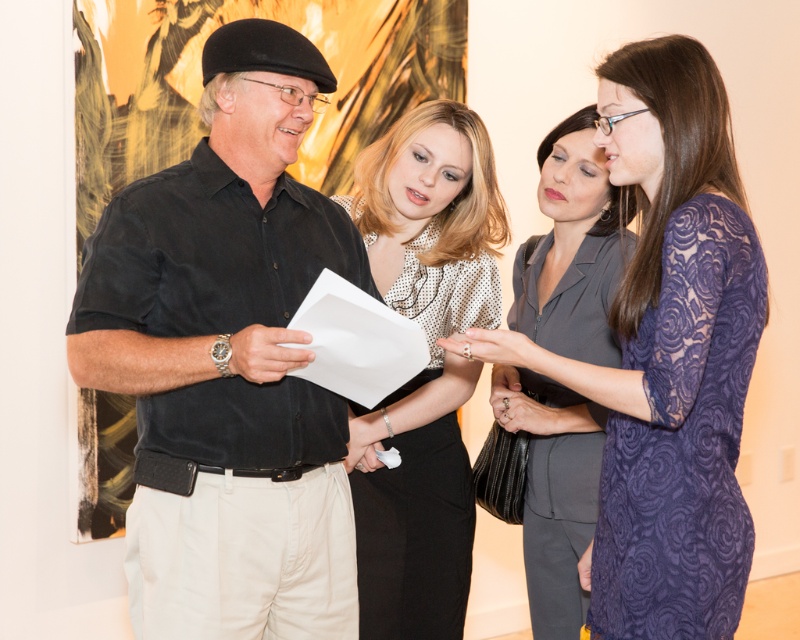
Question: Does polka dot blouse at center appear on the left side of matte gray suit at center?

Choices:
 (A) no
 (B) yes

Answer: (B)

Question: Which point is farther to the camera?

Choices:
 (A) (444, 461)
 (B) (594, 618)
 (C) (572, 572)
 (D) (162, 364)

Answer: (C)

Question: Is lace fabric dress at center to the right of matte gray suit at center from the viewer's perspective?

Choices:
 (A) no
 (B) yes

Answer: (B)

Question: Among these points, which one is nearest to the camera?

Choices:
 (A) (220, 220)
 (B) (408, 458)
 (C) (656, 312)

Answer: (C)

Question: Based on their relative distances, which object is farther from the polka dot blouse at center?

Choices:
 (A) lace fabric dress at center
 (B) matte gray suit at center

Answer: (A)

Question: Does lace fabric dress at center appear on the left side of matte gray suit at center?

Choices:
 (A) yes
 (B) no

Answer: (B)